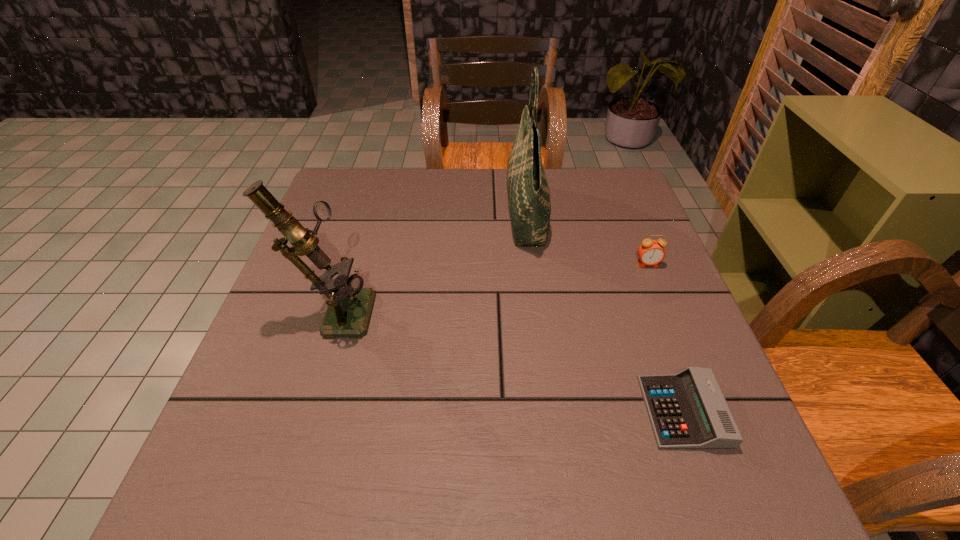
Where is `free space between the leftmost object and the calculator`? The height and width of the screenshot is (540, 960). free space between the leftmost object and the calculator is located at coordinates 509,360.

Identify the location of vacant area that lies between the leftmost object and the shortest object. (509, 360).

Locate an element on the screen. vacant space that is in between the third farthest object and the tallest object is located at coordinates (430, 262).

Where is `free space between the third nearest object and the shortest object`? free space between the third nearest object and the shortest object is located at coordinates (665, 338).

Identify the location of vacant space in between the tallest object and the second nearest object. (430, 262).

Identify the location of vacant area that lies between the tote bag and the nearest object. Image resolution: width=960 pixels, height=540 pixels. (605, 313).

Where is `blank region between the farthest object and the alarm clock`? This screenshot has width=960, height=540. blank region between the farthest object and the alarm clock is located at coordinates (587, 239).

You are a GUI agent. You are given a task and a screenshot of the screen. Output one action in this format:
    pyautogui.click(x=<x>, y=<y>)
    Task: Click on the free space that is in between the nearest object and the tallest object
    The width and height of the screenshot is (960, 540).
    Given the screenshot: What is the action you would take?
    pyautogui.click(x=605, y=313)

The height and width of the screenshot is (540, 960). I want to click on free spot between the third shortest object and the second farthest object, so click(492, 287).

Where is `free point between the third object from right to left and the microscope`? free point between the third object from right to left and the microscope is located at coordinates (430, 262).